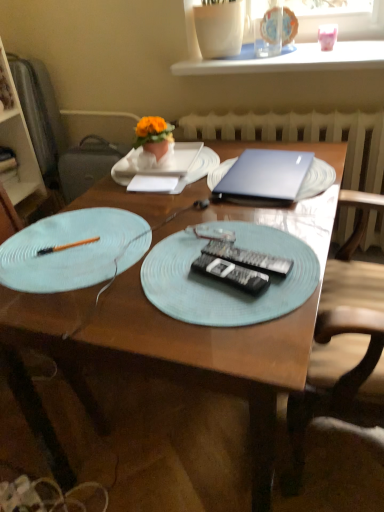
The width and height of the screenshot is (384, 512). In order to click on vacant area that is situated to the right of pink glossy piggy bank at upper right, acting as the second tableware starting from the left in this screenshot , I will do `click(355, 44)`.